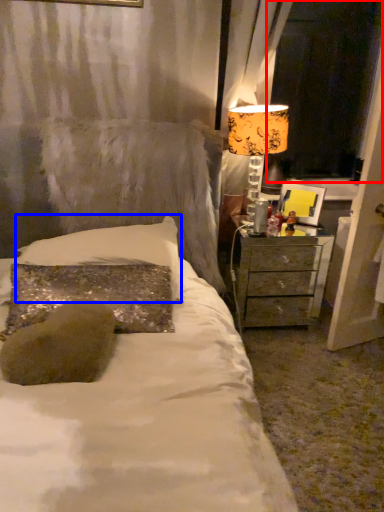
Question: Which of the following is the farthest to the observer, window screen (highlighted by a red box) or pillow (highlighted by a blue box)?

Choices:
 (A) window screen
 (B) pillow

Answer: (A)